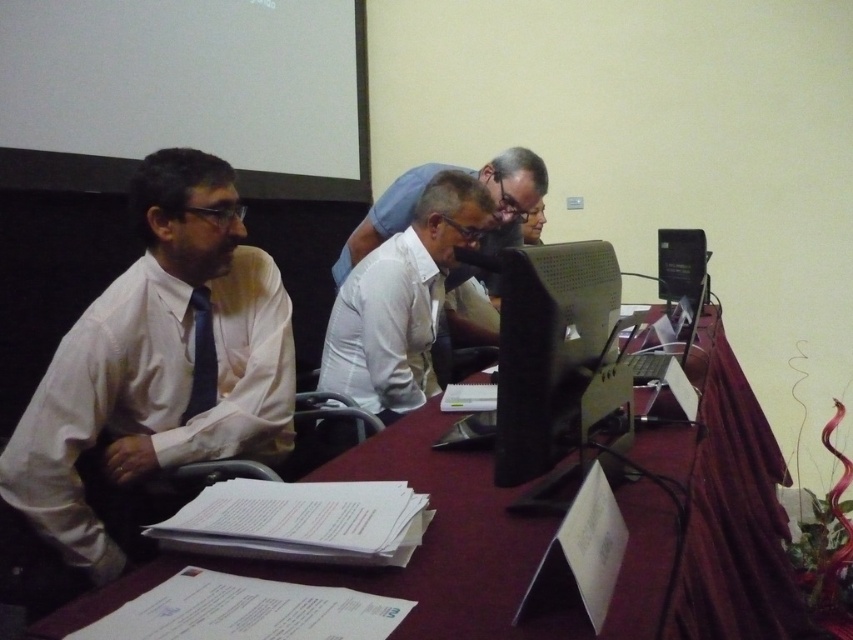
Can you confirm if white shirt at center is positioned below matte black tie at left?

No, white shirt at center is not below matte black tie at left.

Who is more distant from viewer, [399,358] or [206,346]?

Point [399,358]

I want to click on white shirt at center, so click(399, 301).

Between point (105, 458) and point (440, 346), which one is positioned in front?

Positioned in front is point (105, 458).

Who is positioned more to the left, matte white shirt at left or white glossy shirt at center?

matte white shirt at left

Who is more forward, (213, 272) or (498, 172)?

Point (213, 272)

Where is `matte white shirt at left`? matte white shirt at left is located at coordinates (157, 362).

Does matte white shirt at left appear over black plastic computer at right?

No, matte white shirt at left is not above black plastic computer at right.

Find the location of `matte white shirt at left`. matte white shirt at left is located at coordinates pyautogui.click(x=157, y=362).

Describe the element at coordinates (157, 362) in the screenshot. I see `matte white shirt at left` at that location.

Locate an element on the screen. This screenshot has height=640, width=853. matte white shirt at left is located at coordinates (157, 362).